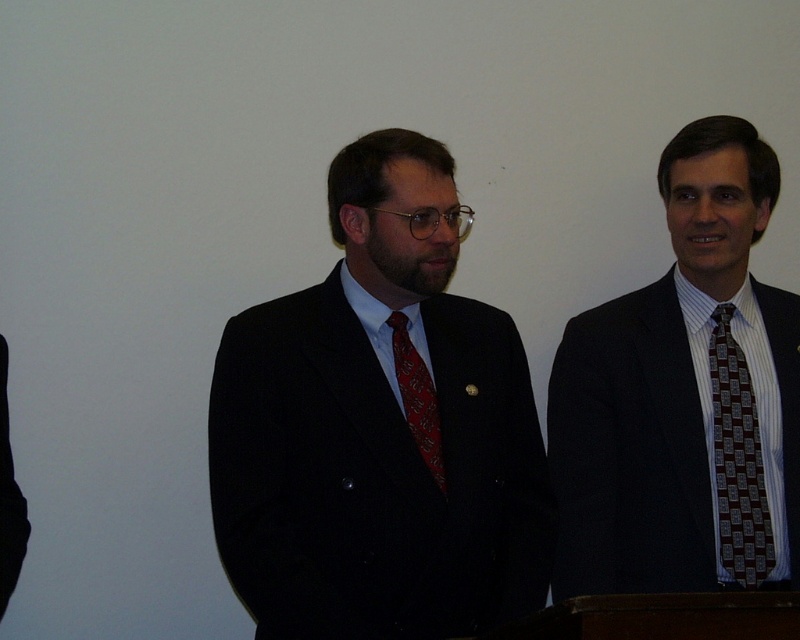
Question: Which point is closer to the camera taking this photo?

Choices:
 (A) (746, 529)
 (B) (432, 410)

Answer: (B)

Question: Does striped cotton shirt at right appear on the left side of red silk tie at center?

Choices:
 (A) no
 (B) yes

Answer: (A)

Question: Observing the image, what is the correct spatial positioning of striped cotton shirt at right in reference to brown patterned tie at right?

Choices:
 (A) above
 (B) below

Answer: (A)

Question: Among these objects, which one is farthest from the camera?

Choices:
 (A) brown patterned tie at right
 (B) striped cotton shirt at right
 (C) matte black suit at center

Answer: (A)

Question: Which object appears closest to the camera in this image?

Choices:
 (A) red silk tie at center
 (B) matte black suit at center
 (C) brown patterned tie at right

Answer: (B)

Question: Does matte black suit at center appear on the left side of striped cotton shirt at right?

Choices:
 (A) yes
 (B) no

Answer: (A)